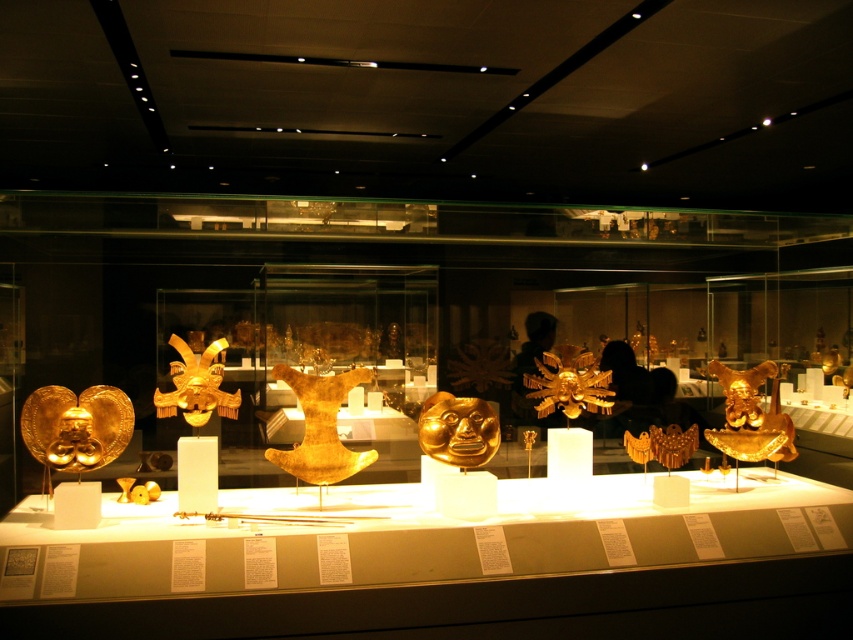
Question: Is gold/golden mask at center smaller than gold shiny mask at center?

Choices:
 (A) yes
 (B) no

Answer: (B)

Question: Estimate the real-world distances between objects in this image. Which object is closer to the gold/metallic mask at center?

Choices:
 (A) gold shiny mask at right
 (B) gold shiny mask at center
 (C) gold/golden mask at center

Answer: (C)

Question: Is gold shiny mask at right bigger than gold/metallic mask at center?

Choices:
 (A) no
 (B) yes

Answer: (B)

Question: Is gold shiny mask at right positioned at the back of gold/metallic mask at center?

Choices:
 (A) no
 (B) yes

Answer: (B)

Question: Which point is farther to the camera?

Choices:
 (A) (761, 435)
 (B) (316, 474)

Answer: (A)

Question: Which of the following is the closest to the observer?

Choices:
 (A) gold/metallic mask at center
 (B) gold/golden mask at center
 (C) gold shiny mask at center

Answer: (B)